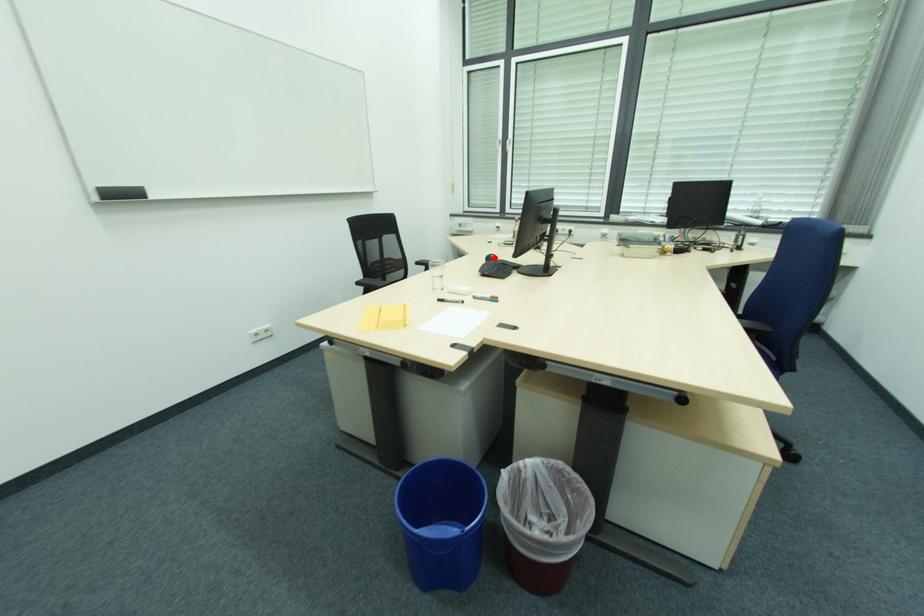
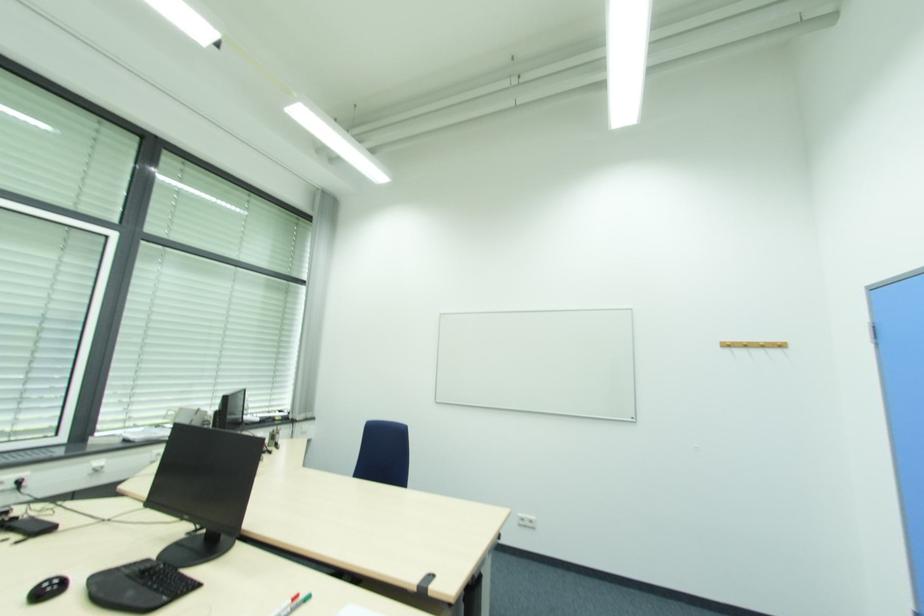
In the second image, find the point that corresponds to the highlighted location in the first image.

(53, 586)